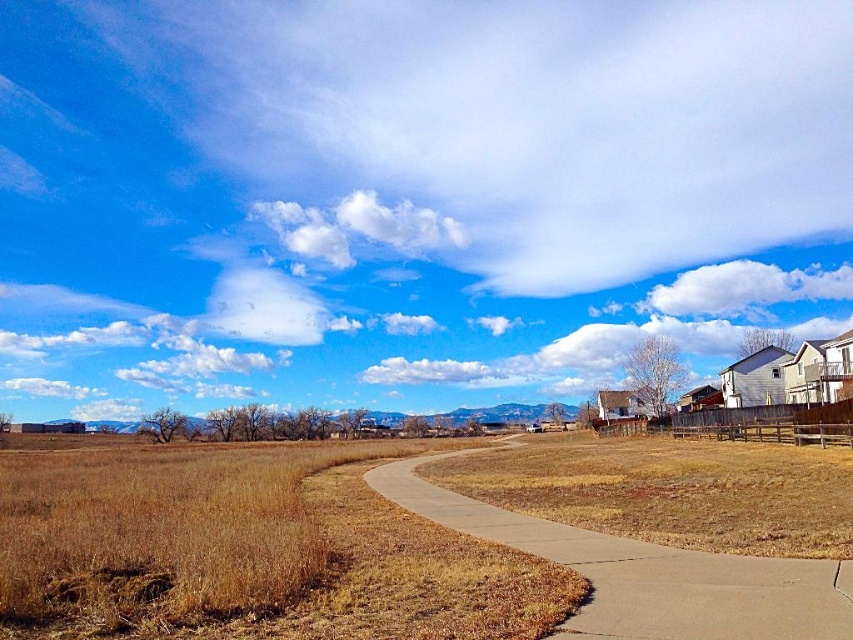
Question: Is smooth concrete path at center behind white fluffy cloud at upper right?

Choices:
 (A) yes
 (B) no

Answer: (B)

Question: In this image, where is white fluffy cloud at upper center located relative to white fluffy cloud at upper right?

Choices:
 (A) left
 (B) right

Answer: (A)

Question: Which of the following is the closest to the observer?

Choices:
 (A) white fluffy cloud at upper center
 (B) smooth concrete path at center

Answer: (B)

Question: Is smooth concrete path at center bigger than white fluffy cloud at upper right?

Choices:
 (A) no
 (B) yes

Answer: (A)

Question: Which point is farther from the camera taking this photo?

Choices:
 (A) (781, 624)
 (B) (387, 230)

Answer: (B)

Question: Which point is closer to the camera taking this photo?

Choices:
 (A) (427, 212)
 (B) (584, 572)
 (C) (744, 296)

Answer: (B)